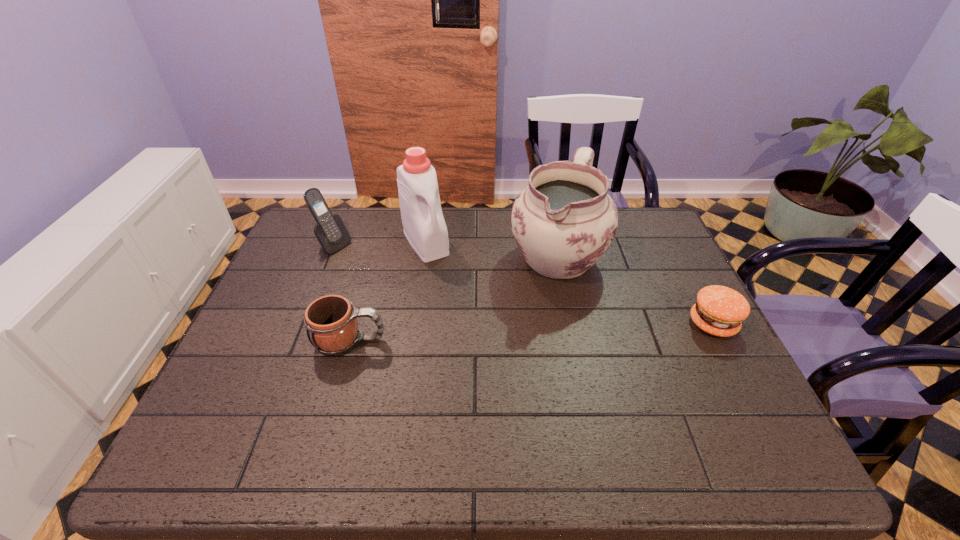
Where is `object positioned at the right edge`? object positioned at the right edge is located at coordinates (719, 310).

This screenshot has width=960, height=540. I want to click on object that is positioned at the far left corner, so click(x=330, y=231).

Locate an element on the screen. This screenshot has height=540, width=960. vacant area at the far edge is located at coordinates (458, 227).

What are the coordinates of `free space at the near edge of the desktop` in the screenshot? It's located at (592, 388).

Image resolution: width=960 pixels, height=540 pixels. I want to click on vacant space at the left edge of the desktop, so click(286, 285).

In the image, there is a desktop. Identify the location of blank space at the right edge. The height and width of the screenshot is (540, 960). pos(660,265).

This screenshot has width=960, height=540. What are the coordinates of `free region at the far left corner of the desktop` in the screenshot? It's located at (301, 226).

Where is `vacant space at the far right corner of the desktop`? This screenshot has height=540, width=960. vacant space at the far right corner of the desktop is located at coordinates (639, 215).

Where is `free spot between the third shortest object and the rightmost object`? free spot between the third shortest object and the rightmost object is located at coordinates (523, 285).

Locate an element on the screen. The width and height of the screenshot is (960, 540). vacant space in between the second object from right to left and the mug is located at coordinates (453, 298).